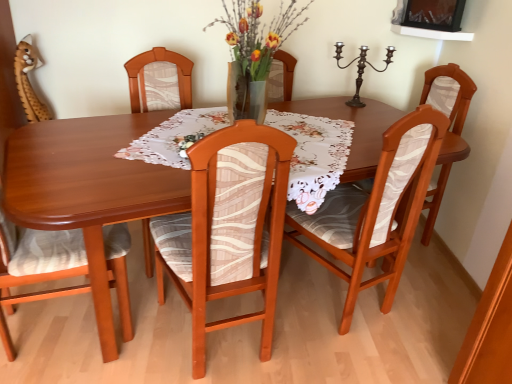
Find the location of a particular element. This screenshot has height=384, width=512. free space to the left of wooden chair with patterned fabric at center, placed as the third chair when sorted from left to right is located at coordinates (141, 331).